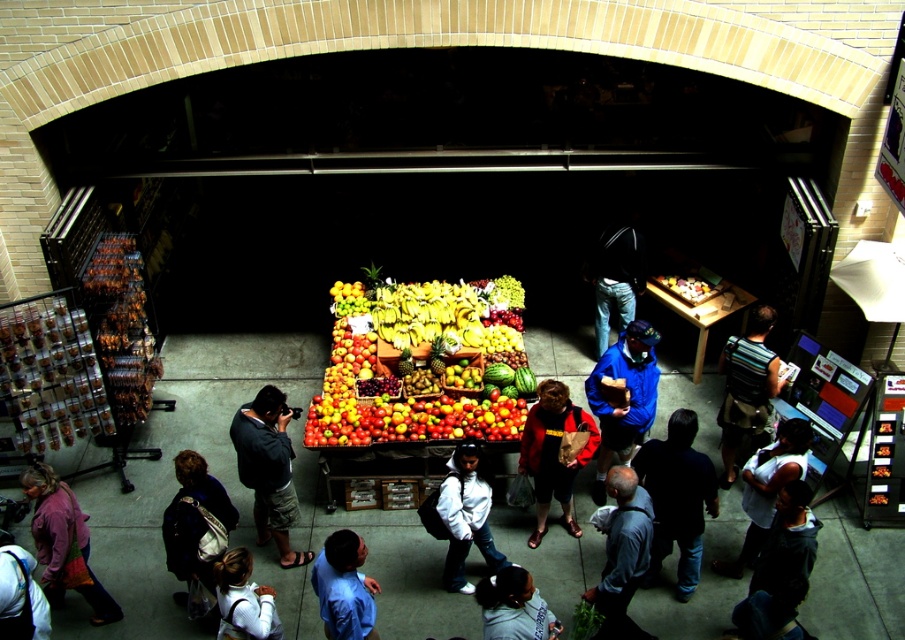
Is dark blue jacket at lower left closer to camera compared to dark blue jeans at center?

Yes, it is.

Is dark blue jacket at lower left bigger than dark blue jeans at center?

No, dark blue jacket at lower left is not bigger than dark blue jeans at center.

This screenshot has height=640, width=905. Find the location of `dark blue jacket at lower left`. dark blue jacket at lower left is located at coordinates (196, 520).

Is dark blue jacket at lower left below white cotton shirt at lower left?

No, dark blue jacket at lower left is not below white cotton shirt at lower left.

Who is more distant from viewer, (186, 496) or (5, 602)?

The point (186, 496) is behind.

Is point (226, 493) behind point (31, 580)?

Yes, point (226, 493) is farther from viewer.

Where is `dark blue jacket at lower left`? dark blue jacket at lower left is located at coordinates (196, 520).

Is point (389, 433) more distant than point (668, 493)?

Yes, point (389, 433) is farther from viewer.

From the picture: Which of these two, glossy wooden fruit stand at center or dark blue shirt at center, stands taller?

Standing taller between the two is dark blue shirt at center.

Does point (399, 426) come closer to viewer compared to point (691, 588)?

No, (399, 426) is further to viewer.

At what (x,y) coordinates should I click in order to perform the action: click on glossy wooden fruit stand at center. Please return your answer as a coordinate pair (x, y). Image resolution: width=905 pixels, height=640 pixels. Looking at the image, I should click on (415, 365).